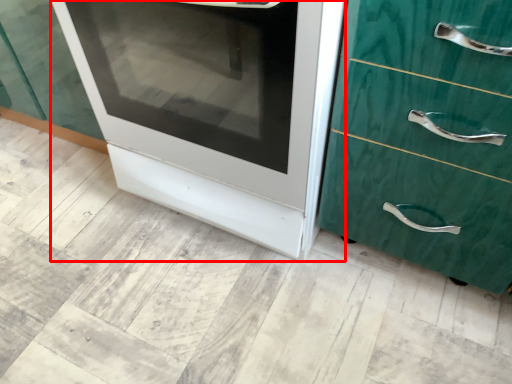
Question: In this image, where is oven (annotated by the red box) located relative to chest of drawers?

Choices:
 (A) right
 (B) left

Answer: (B)